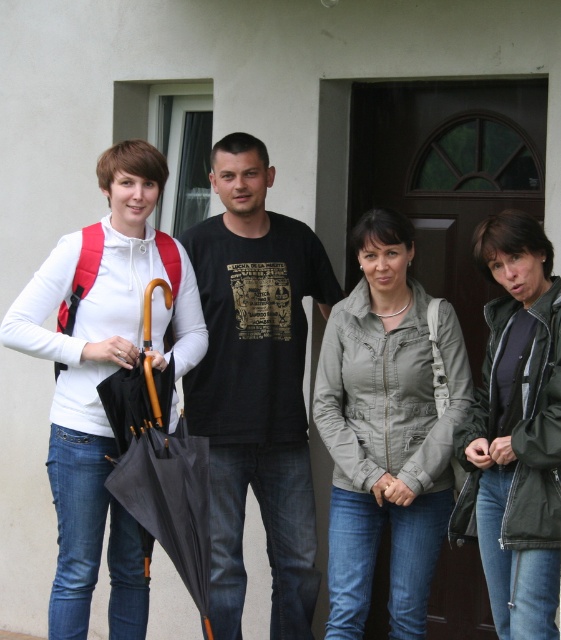
You are standing in front of the building and want to hand an item to the person wearing the green matte jacket at lower right. Which direction should you move relative to the black matte umbrella at left?

The green matte jacket at lower right is to the right of the black matte umbrella at left, so you should move to the right side of the black matte umbrella at left to reach the person wearing the green matte jacket at lower right.